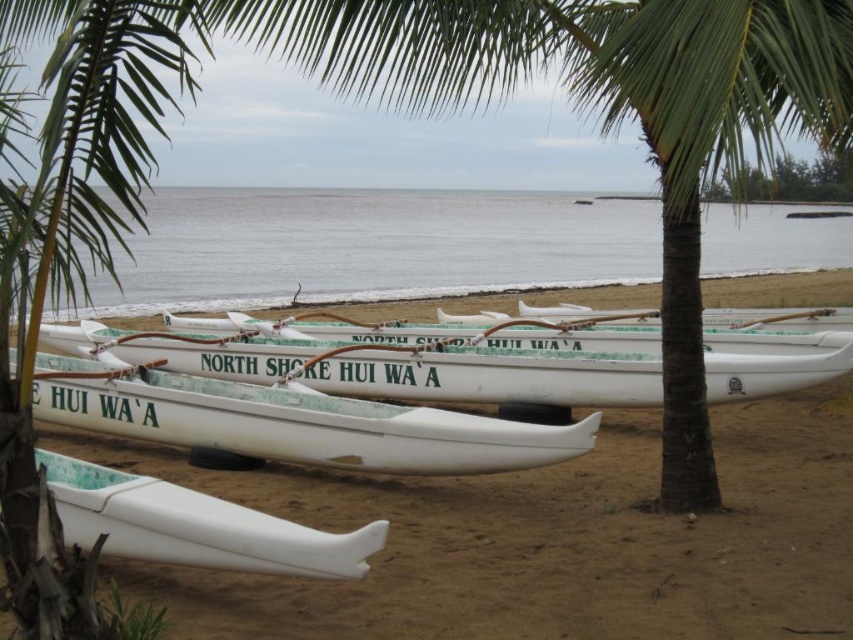
Is white plastic canoe at center closer to the viewer compared to white translucent canoe at center?

Yes, it is in front of white translucent canoe at center.

Can you confirm if white plastic canoe at center is positioned below white translucent canoe at center?

Yes.

Is point (596, 460) positioned behind point (524, 381)?

No, (596, 460) is closer to viewer.

Where is `white plastic canoe at center`? The height and width of the screenshot is (640, 853). white plastic canoe at center is located at coordinates (543, 540).

Between point (329, 488) and point (212, 388), which one is positioned behind?

The point (212, 388) is more distant.

This screenshot has width=853, height=640. What do you see at coordinates (543, 540) in the screenshot?
I see `white plastic canoe at center` at bounding box center [543, 540].

The width and height of the screenshot is (853, 640). What are the coordinates of `white plastic canoe at center` in the screenshot? It's located at (543, 540).

Between point (187, 198) and point (825, 378), which one is positioned in front?

Positioned in front is point (825, 378).

In the scene shown: Which is more to the right, clear water at center or white translucent canoe at center?

clear water at center

Which is behind, point (556, 225) or point (584, 372)?

Positioned behind is point (556, 225).

The width and height of the screenshot is (853, 640). I want to click on clear water at center, so click(x=369, y=248).